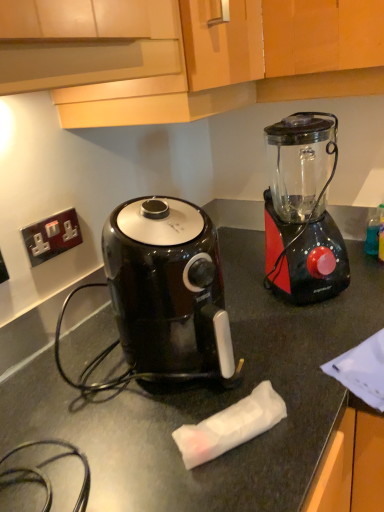
Question: Can you confirm if wooden cabinet at upper center is positioned to the right of metallic socket at upper left?

Choices:
 (A) yes
 (B) no

Answer: (A)

Question: Is wooden cabinet at upper center wider than metallic socket at upper left?

Choices:
 (A) no
 (B) yes

Answer: (B)

Question: From a real-world perspective, is wooden cabinet at upper center physically below metallic socket at upper left?

Choices:
 (A) yes
 (B) no

Answer: (B)

Question: Is wooden cabinet at upper center taller than metallic socket at upper left?

Choices:
 (A) no
 (B) yes

Answer: (B)

Question: Does wooden cabinet at upper center turn towards metallic socket at upper left?

Choices:
 (A) yes
 (B) no

Answer: (B)

Question: Is wooden cabinet at upper center shorter than metallic socket at upper left?

Choices:
 (A) no
 (B) yes

Answer: (A)

Question: Is wooden cabinet at upper center located within black plastic blender at right?

Choices:
 (A) no
 (B) yes

Answer: (A)

Question: Does black plastic blender at right lie in front of wooden cabinet at upper center?

Choices:
 (A) yes
 (B) no

Answer: (B)

Question: From a real-world perspective, does black plastic blender at right stand above wooden cabinet at upper center?

Choices:
 (A) yes
 (B) no

Answer: (B)

Question: From the image's perspective, would you say black plastic blender at right is positioned over wooden cabinet at upper center?

Choices:
 (A) no
 (B) yes

Answer: (A)

Question: From a real-world perspective, is black plastic blender at right located beneath wooden cabinet at upper center?

Choices:
 (A) yes
 (B) no

Answer: (A)

Question: Is black plastic blender at right next to wooden cabinet at upper center and touching it?

Choices:
 (A) yes
 (B) no

Answer: (B)

Question: Does metallic socket at upper left have a greater height compared to wooden cabinet at upper center?

Choices:
 (A) yes
 (B) no

Answer: (B)